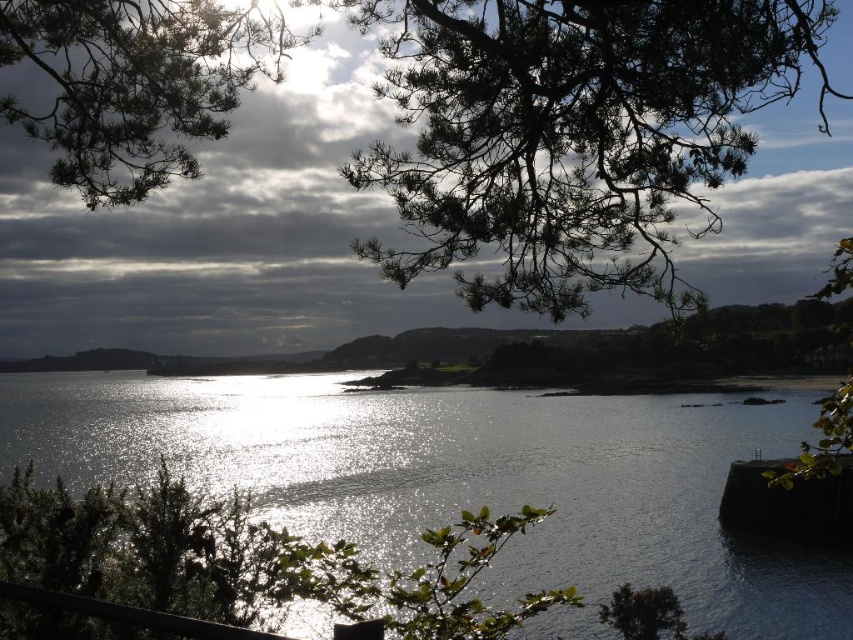
You are standing at the edge of the water and want to find the shiny reflective water at center. According to the coordinates provided, in which direction should you look relative to your position?

The shiny reflective water at center is located at coordinates point (463,480), which means it is to the right and slightly forward of your current position.

You are standing at the coast and see the point marked at coordinates (x=463, y=480). Based on the scene description, what does this point most likely represent?

The point at (x=463, y=480) most likely represents the shiny reflective water at center as indicated by the coordinates in the Objects Description.